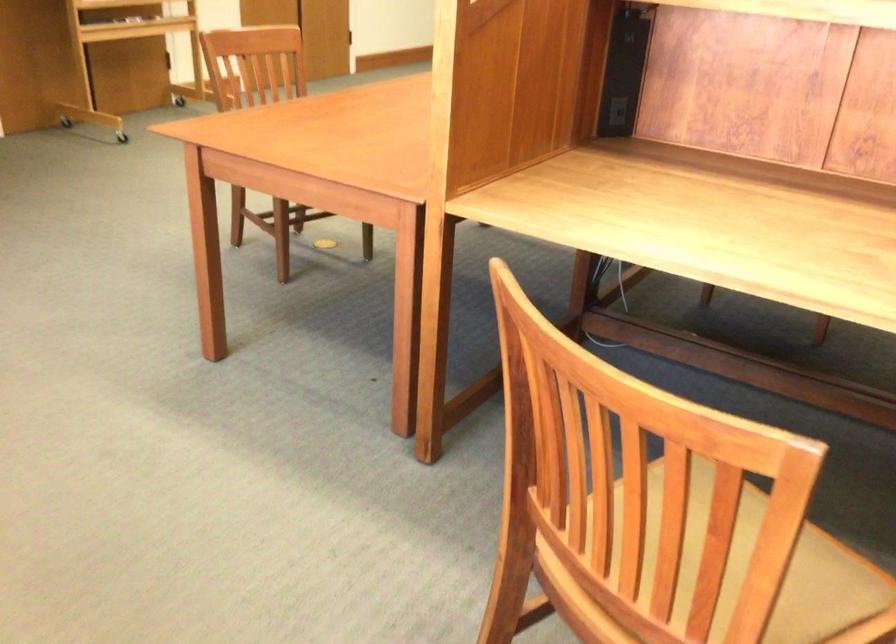
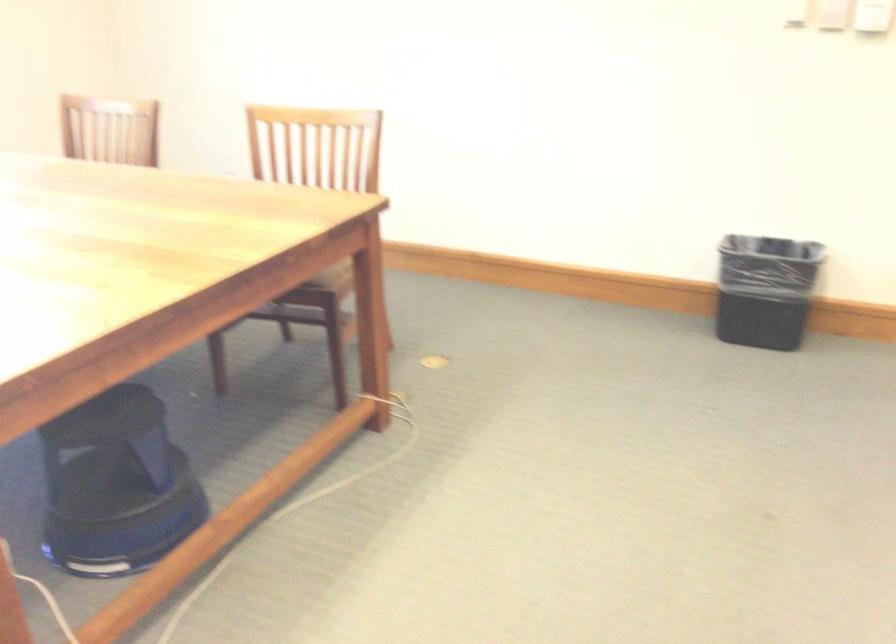
Question: The first image is from the beginning of the video and the second image is from the end. How did the camera likely rotate when shooting the video?

Choices:
 (A) Left
 (B) Right
 (C) Up
 (D) Down

Answer: (A)